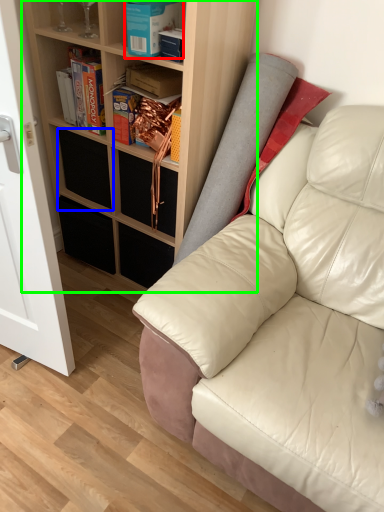
Question: Which is farther away from book (highlighted by a red box)? drawer (highlighted by a blue box) or shelf (highlighted by a green box)?

Choices:
 (A) drawer
 (B) shelf

Answer: (A)